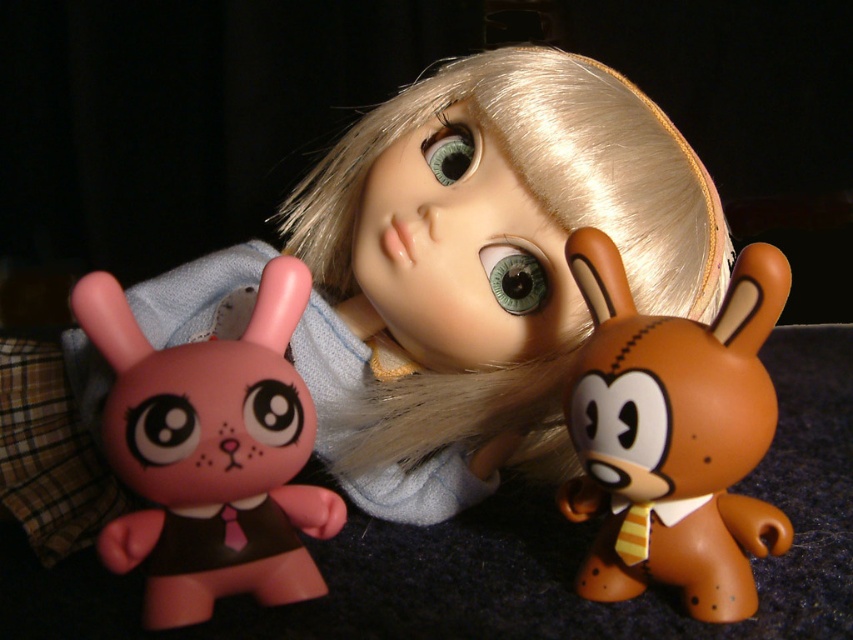
Between brown matte plush toy at center and matte pink plastic bunny at left, which one appears on the right side from the viewer's perspective?

Positioned to the right is brown matte plush toy at center.

Does point (779, 520) lie in front of point (271, 262)?

That is True.

Locate an element on the screen. This screenshot has height=640, width=853. brown matte plush toy at center is located at coordinates (674, 435).

Does matte plastic doll at center have a larger size compared to matte pink plastic bunny at left?

Yes.

Which is in front, point (476, 444) or point (231, 396)?

Positioned in front is point (231, 396).

Locate an element on the screen. matte plastic doll at center is located at coordinates (482, 268).

Does matte plastic doll at center have a lesser width compared to brown matte plush toy at center?

No, matte plastic doll at center is not thinner than brown matte plush toy at center.

From the picture: Does matte plastic doll at center have a lesser height compared to brown matte plush toy at center?

In fact, matte plastic doll at center may be taller than brown matte plush toy at center.

Who is more distant from viewer, [553,129] or [589,340]?

Positioned behind is point [553,129].

The height and width of the screenshot is (640, 853). Identify the location of matte plastic doll at center. (482, 268).